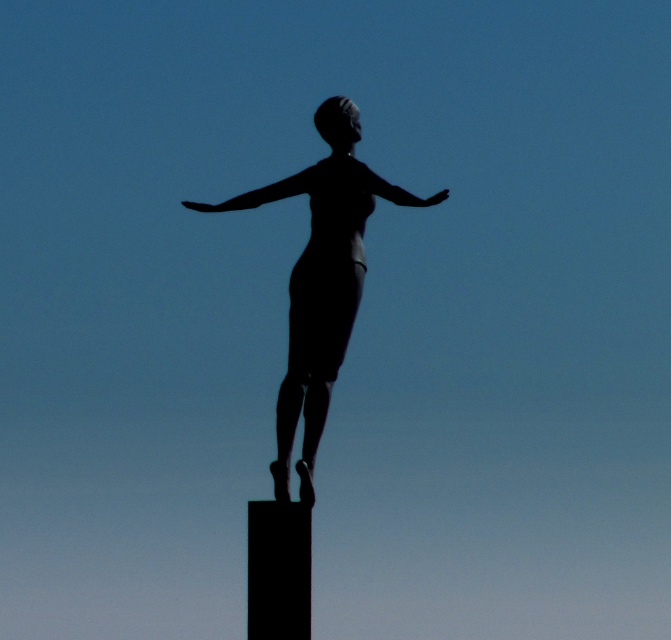
You are an art curator planning to install a new sculpture in a gallery. The sculpture requires a clear path between the silhouette statue at center and the black matte pole at center for visitors to walk around. Based on the image, is there enough space for a visitor who is 1.8 meters tall to comfortably pass between them?

The silhouette statue at center is to the left of the black matte pole at center. Since the objects are positioned side by side at the center, there is likely sufficient horizontal space for a visitor of 1.8 meters to pass between them comfortably, though vertical clearance isn

You are an art curator planning to display the silhouette statue at center and the black matte pole at center in a gallery. Given that the gallery has a narrow corridor only 1 meter wide, can both objects be placed side by side without overlapping?

The silhouette statue at center is wider than the black matte pole at center. Since the corridor is only 1 meter wide, and the statue is wider than the pole, their combined widths may exceed the corridor width. Without exact measurements, it is uncertain if they can fit side by side.

You are an artist trying to sketch the scene. You need to place the black matte arm at center accurately. What are the coordinates for its position?

The coordinates for the black matte arm at center are at point (x=260, y=193).